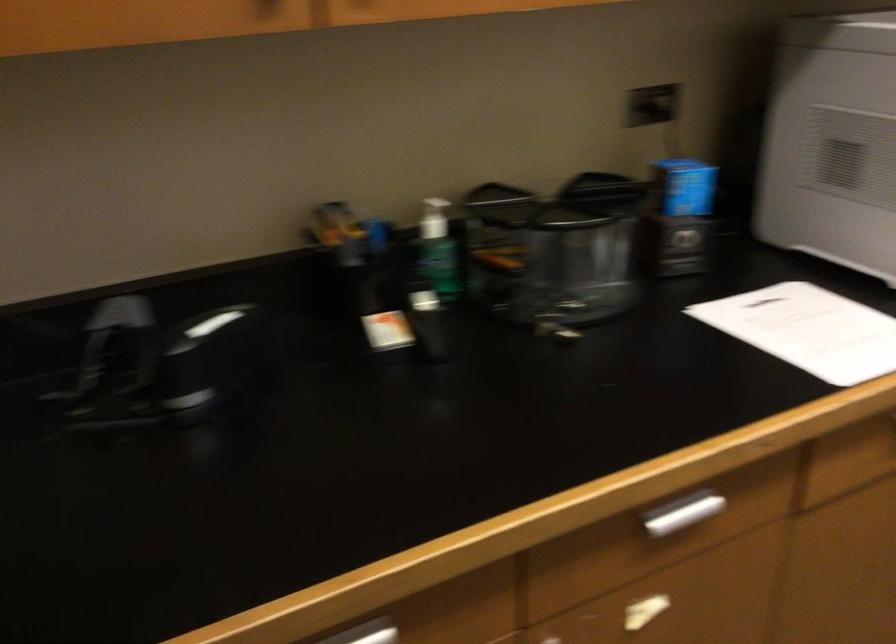
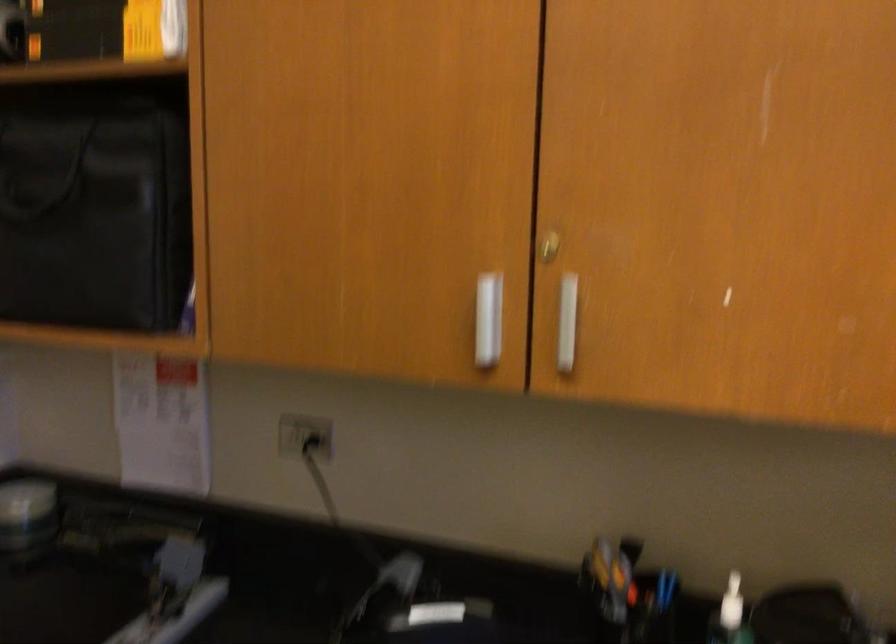
Question: The first image is from the beginning of the video and the second image is from the end. How did the camera likely rotate when shooting the video?

Choices:
 (A) Left
 (B) Right
 (C) Up
 (D) Down

Answer: (A)